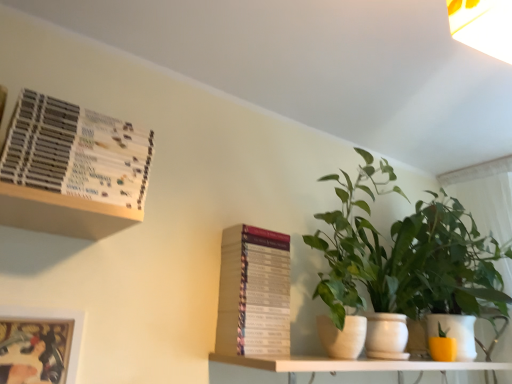
Question: Considering the relative sizes of hardcover book at upper left, which ranks as the first paperback book in front-to-back order, and green leafy plant at right, which appears as the second houseplant when viewed from the left, in the image provided, is hardcover book at upper left, which ranks as the first paperback book in front-to-back order, taller than green leafy plant at right, which appears as the second houseplant when viewed from the left,?

Choices:
 (A) yes
 (B) no

Answer: (B)

Question: Is the depth of hardcover book at upper left, the 2th paperback book positioned from the right, greater than that of green leafy plant at right, the first houseplant from the right?

Choices:
 (A) no
 (B) yes

Answer: (A)

Question: Is hardcover book at upper left, the 2th paperback book positioned from the right, closer to the viewer compared to green leafy plant at right, the first houseplant from the right?

Choices:
 (A) yes
 (B) no

Answer: (A)

Question: Can you confirm if hardcover book at upper left, which is counted as the 2th paperback book, starting from the bottom, is thinner than green leafy plant at right, the first houseplant from the right?

Choices:
 (A) no
 (B) yes

Answer: (B)

Question: Are hardcover book at upper left, which ranks as the first paperback book in front-to-back order, and green leafy plant at right, which appears as the second houseplant when viewed from the left, located far from each other?

Choices:
 (A) yes
 (B) no

Answer: (A)

Question: Considering the relative sizes of hardcover book at upper left, which ranks as the first paperback book in front-to-back order, and green leafy plant at right, which appears as the second houseplant when viewed from the left, in the image provided, is hardcover book at upper left, which ranks as the first paperback book in front-to-back order, wider than green leafy plant at right, which appears as the second houseplant when viewed from the left,?

Choices:
 (A) yes
 (B) no

Answer: (B)

Question: Does green leafy plant at right, the first houseplant from the right, have a lesser width compared to metallic silver picture frame at lower left?

Choices:
 (A) no
 (B) yes

Answer: (A)

Question: From the image's perspective, does green leafy plant at right, which appears as the second houseplant when viewed from the left, appear higher than metallic silver picture frame at lower left?

Choices:
 (A) no
 (B) yes

Answer: (B)

Question: Can you confirm if green leafy plant at right, the first houseplant from the right, is smaller than metallic silver picture frame at lower left?

Choices:
 (A) yes
 (B) no

Answer: (B)

Question: From a real-world perspective, is green leafy plant at right, which appears as the second houseplant when viewed from the left, under metallic silver picture frame at lower left?

Choices:
 (A) no
 (B) yes

Answer: (A)

Question: Is green leafy plant at right, the first houseplant from the right, behind metallic silver picture frame at lower left?

Choices:
 (A) yes
 (B) no

Answer: (A)

Question: Considering the relative positions of green leafy plant at right, which appears as the second houseplant when viewed from the left, and metallic silver picture frame at lower left in the image provided, is green leafy plant at right, which appears as the second houseplant when viewed from the left, to the left of metallic silver picture frame at lower left from the viewer's perspective?

Choices:
 (A) no
 (B) yes

Answer: (A)

Question: Considering the relative sizes of green leafy plant at right, which is counted as the 2th houseplant, starting from the right, and hardcover book at center, the second paperback book positioned from the left, in the image provided, is green leafy plant at right, which is counted as the 2th houseplant, starting from the right, wider than hardcover book at center, the second paperback book positioned from the left,?

Choices:
 (A) yes
 (B) no

Answer: (A)